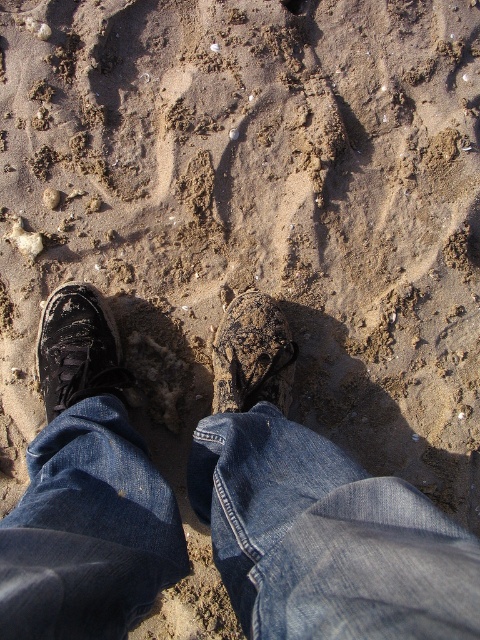
Does black leather shoe at lower left come in front of leather textured shoe at center?

That is True.

Is point (64, 285) positioned before point (272, 353)?

No, (64, 285) is behind (272, 353).

Does point (75, 292) come farther from viewer compared to point (229, 388)?

Yes, point (75, 292) is farther from viewer.

I want to click on black leather shoe at lower left, so click(78, 348).

Is denim at center above black leather shoe at lower left?

No.

Between denim at center and black leather shoe at lower left, which one is positioned lower?

denim at center

Image resolution: width=480 pixels, height=640 pixels. I want to click on denim at center, so click(325, 538).

Does denim at center have a lesser height compared to leather textured shoe at center?

Yes, denim at center is shorter than leather textured shoe at center.

Is denim at center closer to camera compared to leather textured shoe at center?

Yes, denim at center is in front of leather textured shoe at center.

Is point (277, 586) farther from camera compared to point (285, 371)?

No, (277, 586) is closer to viewer.

Where is `denim at center`? This screenshot has width=480, height=640. denim at center is located at coordinates (325, 538).